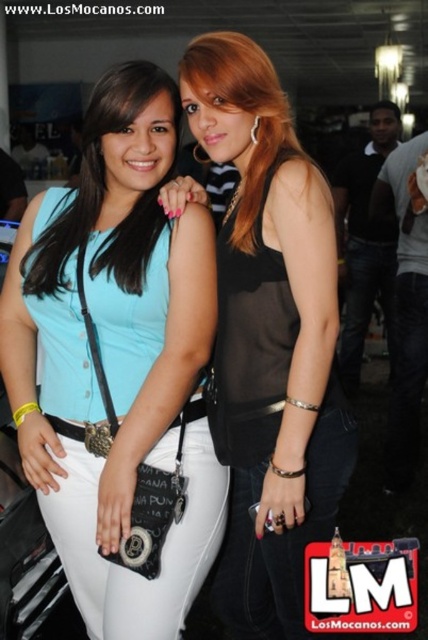
Question: Does matte black top at center have a greater width compared to black sheer top at center?

Choices:
 (A) no
 (B) yes

Answer: (B)

Question: Which point is farther to the camera?

Choices:
 (A) black sheer top at center
 (B) matte black top at center

Answer: (B)

Question: Which of the following is the closest to the observer?

Choices:
 (A) (92, 225)
 (B) (285, 380)

Answer: (B)

Question: Does matte black top at center come behind black sheer top at center?

Choices:
 (A) no
 (B) yes

Answer: (B)

Question: Is matte black top at center further to camera compared to black sheer top at center?

Choices:
 (A) no
 (B) yes

Answer: (B)